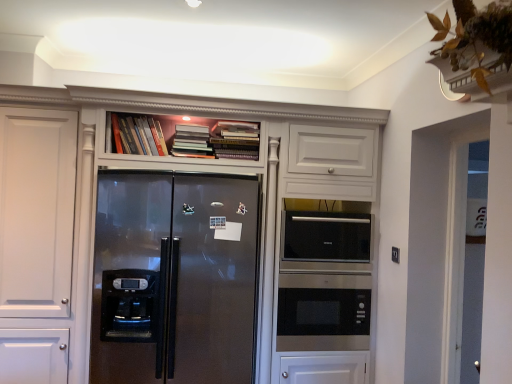
Question: Does stainless steel microwave at center appear on the right side of hardcover books at upper center, the first book viewed from the left?

Choices:
 (A) no
 (B) yes

Answer: (B)

Question: Can you confirm if stainless steel microwave at center is bigger than hardcover books at upper center, the first book viewed from the left?

Choices:
 (A) no
 (B) yes

Answer: (B)

Question: Is stainless steel microwave at center not close to hardcover books at upper center, the first book viewed from the left?

Choices:
 (A) yes
 (B) no

Answer: (A)

Question: Does stainless steel microwave at center appear on the left side of hardcover books at upper center, marked as the 3th book in a right-to-left arrangement?

Choices:
 (A) yes
 (B) no

Answer: (B)

Question: Considering the relative sizes of stainless steel microwave at center and hardcover books at upper center, marked as the 3th book in a right-to-left arrangement, in the image provided, is stainless steel microwave at center wider than hardcover books at upper center, marked as the 3th book in a right-to-left arrangement,?

Choices:
 (A) no
 (B) yes

Answer: (B)

Question: Considering the positions of point (352, 216) and point (189, 253), is point (352, 216) closer or farther from the camera than point (189, 253)?

Choices:
 (A) farther
 (B) closer

Answer: (A)

Question: Is sleek stainless steel microwave at center taller or shorter than satin black refrigerator at center?

Choices:
 (A) short
 (B) tall

Answer: (A)

Question: Considering their positions, is sleek stainless steel microwave at center located in front of or behind satin black refrigerator at center?

Choices:
 (A) behind
 (B) front

Answer: (A)

Question: Based on their sizes in the image, would you say sleek stainless steel microwave at center is bigger or smaller than satin black refrigerator at center?

Choices:
 (A) big
 (B) small

Answer: (B)

Question: Would you say satin white cabinet at upper center is inside or outside satin black refrigerator at center?

Choices:
 (A) inside
 (B) outside

Answer: (A)

Question: Considering the relative positions of satin white cabinet at upper center and satin black refrigerator at center in the image provided, is satin white cabinet at upper center to the left or to the right of satin black refrigerator at center?

Choices:
 (A) right
 (B) left

Answer: (A)

Question: Is point (351, 152) positioned closer to the camera than point (179, 306)?

Choices:
 (A) closer
 (B) farther

Answer: (B)

Question: In terms of height, does satin white cabinet at upper center look taller or shorter compared to satin black refrigerator at center?

Choices:
 (A) short
 (B) tall

Answer: (B)

Question: From the image's perspective, is satin white cabinet at upper center positioned above or below hardcover books at upper center, the third book positioned from the left?

Choices:
 (A) above
 (B) below

Answer: (B)

Question: Relative to hardcover books at upper center, the third book positioned from the left, is satin white cabinet at upper center in front or behind?

Choices:
 (A) front
 (B) behind

Answer: (A)